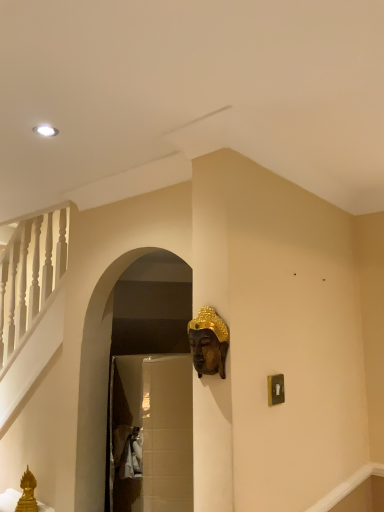
This screenshot has height=512, width=384. Describe the element at coordinates (208, 342) in the screenshot. I see `gold textured head at upper center` at that location.

Where is `gold textured head at upper center`? The height and width of the screenshot is (512, 384). gold textured head at upper center is located at coordinates [x=208, y=342].

This screenshot has width=384, height=512. I want to click on gold textured head at upper center, so click(x=208, y=342).